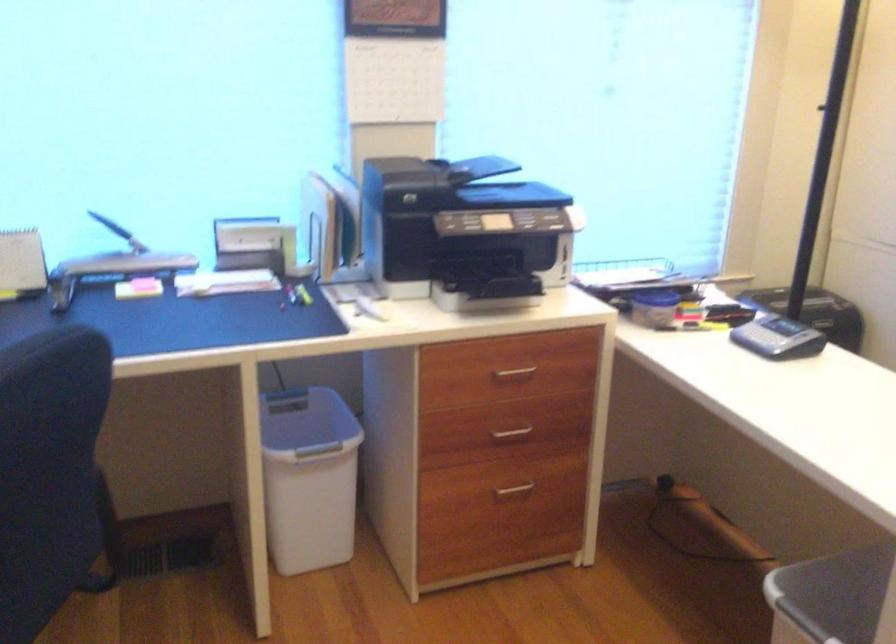
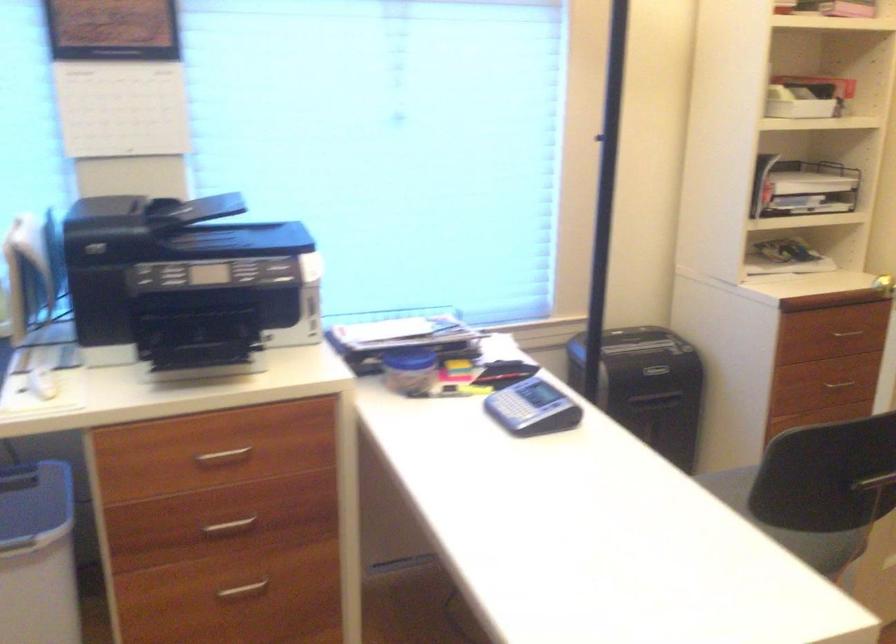
Locate, in the second image, the point that corresponds to point 503,281 in the first image.

(197, 351)